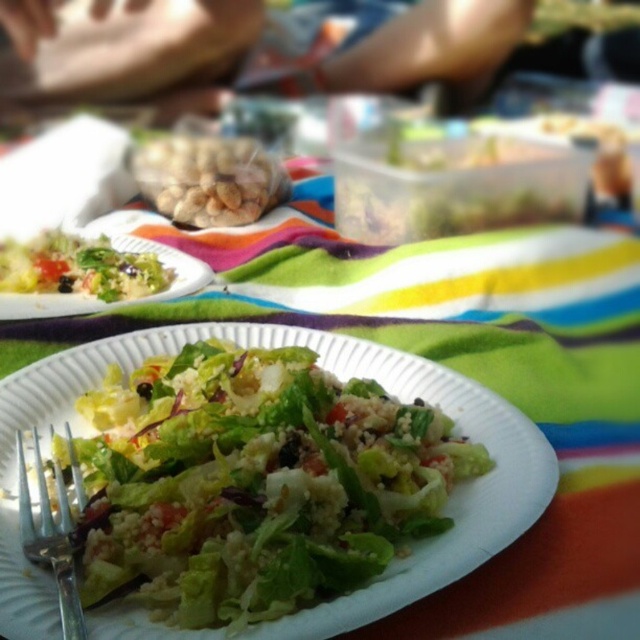
Question: Is the position of green leafy salad at center less distant than that of silver metallic fork at lower left?

Choices:
 (A) yes
 (B) no

Answer: (B)

Question: Observing the image, what is the correct spatial positioning of green leafy salad at center in reference to silver metallic fork at lower left?

Choices:
 (A) right
 (B) left

Answer: (A)

Question: Which of the following is the farthest from the observer?

Choices:
 (A) (60, 476)
 (B) (234, 168)

Answer: (B)

Question: Is translucent plastic bag of nuts at center above silver metallic fork at lower left?

Choices:
 (A) yes
 (B) no

Answer: (A)

Question: Which of the following is the farthest from the observer?

Choices:
 (A) silver metallic fork at lower left
 (B) green leafy salad at left
 (C) green leafy salad at center

Answer: (B)

Question: Among these objects, which one is nearest to the camera?

Choices:
 (A) translucent plastic bag of nuts at center
 (B) green leafy salad at left
 (C) green leafy salad at center

Answer: (C)